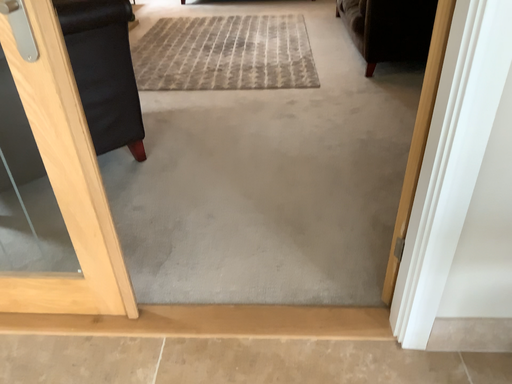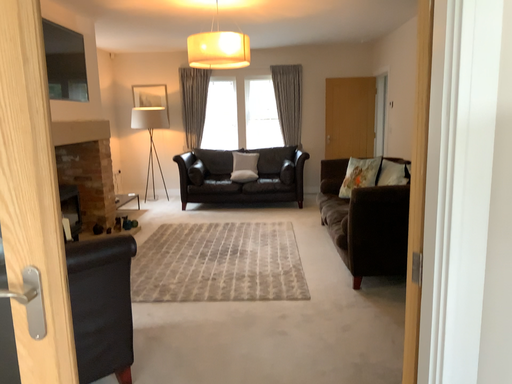
Question: How did the camera likely rotate when shooting the video?

Choices:
 (A) rotated upward
 (B) rotated downward

Answer: (A)